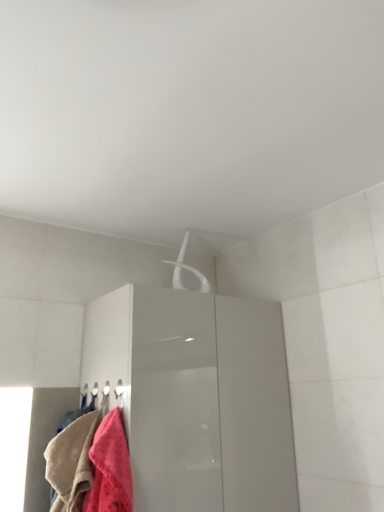
Question: Is fluffy pink towel at lower left wider or thinner than glossy white cabinet at upper center?

Choices:
 (A) thin
 (B) wide

Answer: (A)

Question: Is fluffy pink towel at lower left inside the boundaries of glossy white cabinet at upper center, or outside?

Choices:
 (A) inside
 (B) outside

Answer: (B)

Question: In terms of height, does fluffy pink towel at lower left look taller or shorter compared to glossy white cabinet at upper center?

Choices:
 (A) short
 (B) tall

Answer: (A)

Question: From the image's perspective, is glossy white cabinet at upper center above or below fluffy pink towel at lower left?

Choices:
 (A) above
 (B) below

Answer: (B)

Question: In terms of height, does glossy white cabinet at upper center look taller or shorter compared to fluffy pink towel at lower left?

Choices:
 (A) tall
 (B) short

Answer: (A)

Question: Choose the correct answer: Is glossy white cabinet at upper center inside fluffy pink towel at lower left or outside it?

Choices:
 (A) inside
 (B) outside

Answer: (B)

Question: Considering the positions of point (261, 357) and point (79, 480), is point (261, 357) closer or farther from the camera than point (79, 480)?

Choices:
 (A) closer
 (B) farther

Answer: (B)